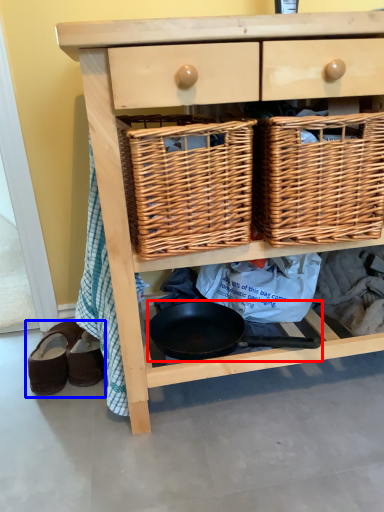
Question: Which object appears farthest to the camera in this image, frying pan (highlighted by a red box) or footwear (highlighted by a blue box)?

Choices:
 (A) frying pan
 (B) footwear

Answer: (B)